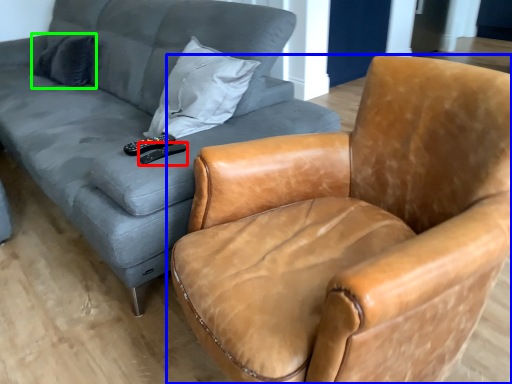
Question: Based on their relative distances, which object is nearer to remote (highlighted by a red box)? Choose from chair (highlighted by a blue box) and pillow (highlighted by a green box).

Choices:
 (A) chair
 (B) pillow

Answer: (A)